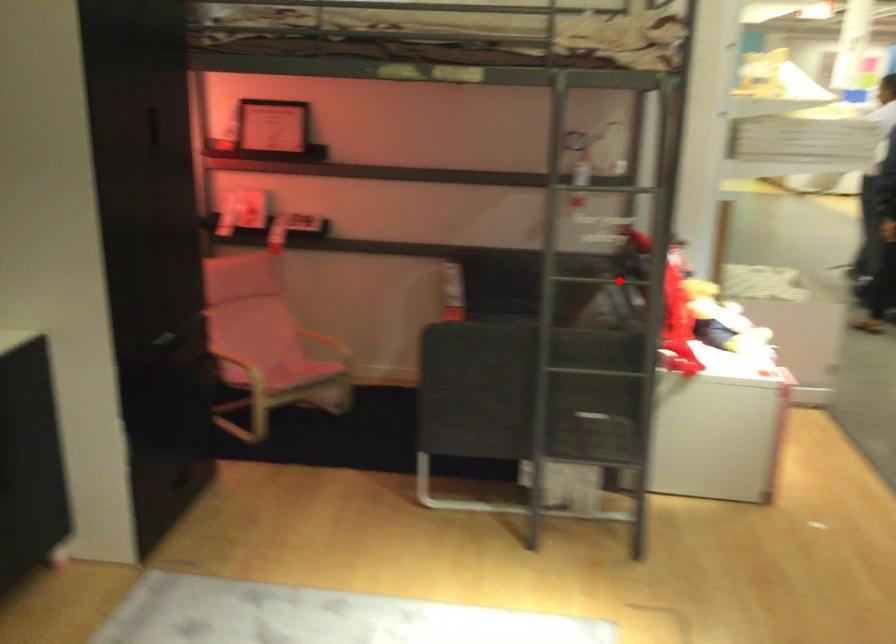
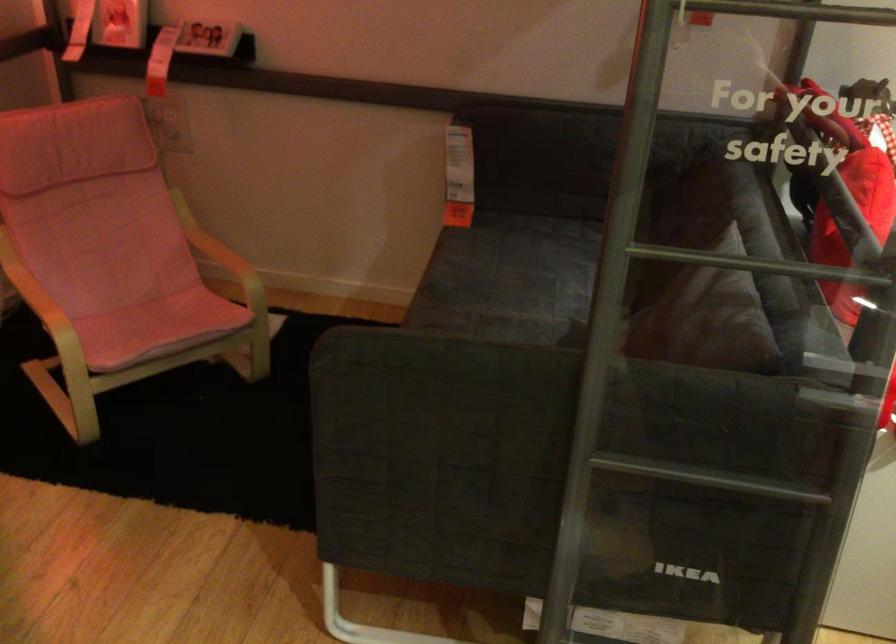
Question: I am providing you with two images of the same scene from different viewpoints. A red point is marked on the first image. At the location where the point appears in image 1, is it still visible in image 2?

Choices:
 (A) Yes
 (B) No

Answer: (A)